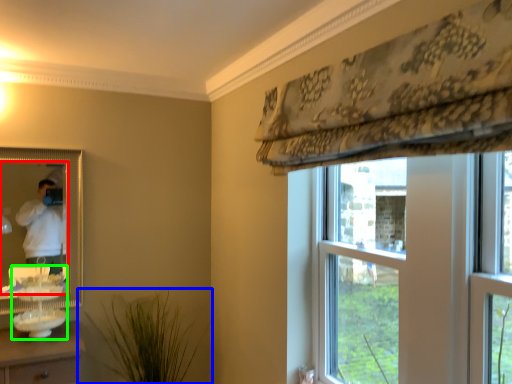
Question: Which object is the closest to the mirror (highlighted by a red box)? Choose among these: houseplant (highlighted by a blue box) or sink (highlighted by a green box).

Choices:
 (A) houseplant
 (B) sink

Answer: (B)